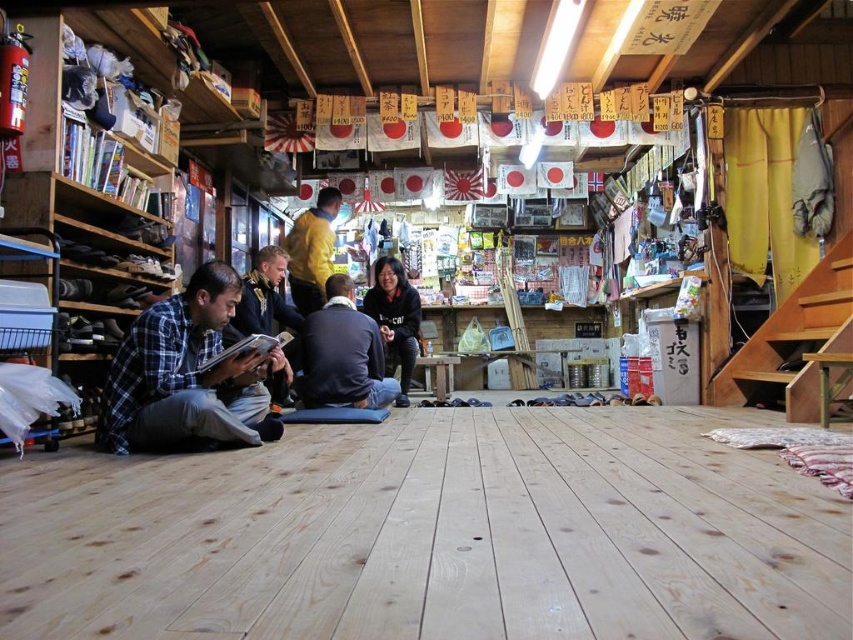
Question: Is golden leather jacket at center smaller than black matte jacket at center?

Choices:
 (A) yes
 (B) no

Answer: (B)

Question: Is the position of dark gray sweater at center less distant than that of black matte jacket at center?

Choices:
 (A) no
 (B) yes

Answer: (B)

Question: Where is plaid fabric shirt at lower left located in relation to yellow matte shirt at center in the image?

Choices:
 (A) below
 (B) above

Answer: (A)

Question: Which point is closer to the camera?

Choices:
 (A) black matte jacket at center
 (B) dark gray sweater at center
 (C) golden leather jacket at center
 (D) plaid fabric shirt at lower left

Answer: (D)

Question: Which point is closer to the camera?

Choices:
 (A) (402, 342)
 (B) (289, 252)

Answer: (A)

Question: Which object appears farthest from the camera in this image?

Choices:
 (A) black matte jacket at center
 (B) plaid fabric shirt at lower left
 (C) golden leather jacket at center
 (D) dark gray sweater at center

Answer: (A)